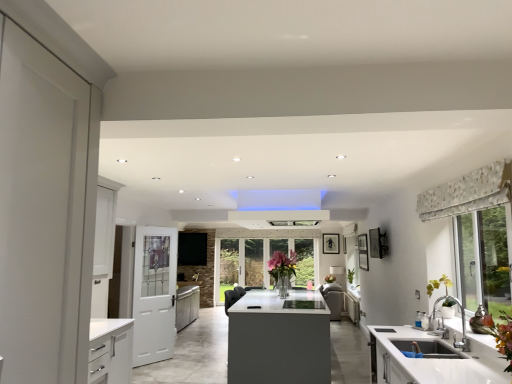
Question: Is the position of clear glass vase at center less distant than that of green matte plant at right?

Choices:
 (A) yes
 (B) no

Answer: (B)

Question: Is clear glass vase at center at the right side of green matte plant at right?

Choices:
 (A) no
 (B) yes

Answer: (A)

Question: Can you confirm if clear glass vase at center is wider than green matte plant at right?

Choices:
 (A) yes
 (B) no

Answer: (A)

Question: Can you confirm if clear glass vase at center is thinner than green matte plant at right?

Choices:
 (A) yes
 (B) no

Answer: (B)

Question: Is clear glass vase at center further to camera compared to green matte plant at right?

Choices:
 (A) no
 (B) yes

Answer: (B)

Question: From a real-world perspective, is white glossy cabinet at center positioned above or below green matte plant at right?

Choices:
 (A) below
 (B) above

Answer: (A)

Question: Would you say white glossy cabinet at center is inside or outside green matte plant at right?

Choices:
 (A) outside
 (B) inside

Answer: (A)

Question: From the image's perspective, relative to green matte plant at right, is white glossy cabinet at center above or below?

Choices:
 (A) below
 (B) above

Answer: (A)

Question: Is white glossy cabinet at center to the left or to the right of green matte plant at right in the image?

Choices:
 (A) right
 (B) left

Answer: (A)

Question: From a real-world perspective, is white matte door at left positioned above or below patterned fabric valance at upper right?

Choices:
 (A) above
 (B) below

Answer: (B)

Question: Is point click(x=135, y=274) positioned closer to the camera than point click(x=454, y=195)?

Choices:
 (A) closer
 (B) farther

Answer: (B)

Question: Is white matte door at left wider or thinner than patterned fabric valance at upper right?

Choices:
 (A) wide
 (B) thin

Answer: (A)

Question: In the image, is white matte door at left positioned in front of or behind patterned fabric valance at upper right?

Choices:
 (A) behind
 (B) front

Answer: (A)

Question: Based on their sizes in the image, would you say green matte plant at right is bigger or smaller than white glossy cabinet at center?

Choices:
 (A) small
 (B) big

Answer: (A)

Question: From a real-world perspective, relative to white glossy cabinet at center, is green matte plant at right vertically above or below?

Choices:
 (A) above
 (B) below

Answer: (A)